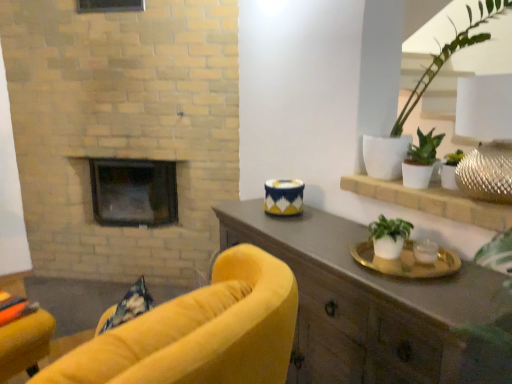
What do you see at coordinates (133, 192) in the screenshot? I see `black glass fireplace at center` at bounding box center [133, 192].

Measure the distance between point [250,296] and camera.

Point [250,296] and camera are 36.46 inches apart.

The height and width of the screenshot is (384, 512). Describe the element at coordinates (284, 197) in the screenshot. I see `blue and white ceramic candle holder at center` at that location.

What do you see at coordinates (450, 169) in the screenshot? I see `green matte houseplant at upper right, the third houseplant from the top` at bounding box center [450, 169].

What is the approximate width of matte brown cabinet at right?

It is 49.09 centimeters.

In order to face white matte plant pot at right, arranged as the second houseplant when viewed from the top, should I rotate leftwards or rightwards?

A 20.950 degree turn to the right will do.

Where is `black glass fireplace at center`? The width and height of the screenshot is (512, 384). black glass fireplace at center is located at coordinates (133, 192).

Can you confirm if velvet yellow armchair at center, the second chair in the left-to-right sequence, is smaller than blue and white ceramic candle holder at center?

Actually, velvet yellow armchair at center, the second chair in the left-to-right sequence, might be larger than blue and white ceramic candle holder at center.

Does velvet yellow armchair at center, the 2th chair viewed from the back, appear on the right side of blue and white ceramic candle holder at center?

No.

From the image's perspective, is black glass fireplace at center above white ceramic plant at upper right?

Yes, from the image's perspective, black glass fireplace at center is on top of white ceramic plant at upper right.

Is black glass fireplace at center positioned with its back to white ceramic plant at upper right?

No.

Find the location of a particular element. The width and height of the screenshot is (512, 384). shelf in front of the black glass fireplace at center is located at coordinates (432, 201).

Looking at this image, would you say white ceramic plant at upper right is inside or outside velvet yellow armchair at center, the 2th chair viewed from the back?

white ceramic plant at upper right is not inside velvet yellow armchair at center, the 2th chair viewed from the back, it's outside.

From the picture: Between white ceramic plant at upper right and velvet yellow armchair at center, which is the 1th chair in front-to-back order, which one is positioned in front?

Positioned in front is velvet yellow armchair at center, which is the 1th chair in front-to-back order.

Identify the location of chair lying in front of the white ceramic plant at upper right. This screenshot has width=512, height=384. (199, 332).

Looking at the image, does white ceramic plant at upper right seem bigger or smaller compared to velvet yellow armchair at center, which is the 1th chair in front-to-back order?

Clearly, white ceramic plant at upper right is smaller in size than velvet yellow armchair at center, which is the 1th chair in front-to-back order.

Is matte brown cabinet at right far away from white matte plant pot at right, the 3th houseplant in the bottom-to-top sequence?

That's not correct — matte brown cabinet at right is a little close to white matte plant pot at right, the 3th houseplant in the bottom-to-top sequence.

Which of these two, matte brown cabinet at right or white matte plant pot at right, arranged as the second houseplant when viewed from the top, is wider?

matte brown cabinet at right is wider.

You are a GUI agent. You are given a task and a screenshot of the screen. Output one action in this format:
    pyautogui.click(x=<x>, y=<y>)
    Task: Click on the cabinetry below the white matte plant pot at right, arranged as the second houseplant when viewed from the top (from a real-world perspective)
    
    Given the screenshot: What is the action you would take?
    pyautogui.click(x=371, y=307)

From a real-world perspective, does matte brown cabinet at right sit lower than white matte plant pot at right, the 3th houseplant in the bottom-to-top sequence?

Correct, in the physical world, matte brown cabinet at right is lower than white matte plant pot at right, the 3th houseplant in the bottom-to-top sequence.

Does velvet yellow armchair at lower left, which appears as the 1th chair when viewed from the left, have a greater width compared to white ceramic plant at upper right?

In fact, velvet yellow armchair at lower left, which appears as the 1th chair when viewed from the left, might be narrower than white ceramic plant at upper right.

Identify the location of chair behind the white ceramic plant at upper right. This screenshot has width=512, height=384. (25, 343).

Considering the positions of points (46, 349) and (503, 209), is point (46, 349) closer to camera compared to point (503, 209)?

No, it is behind (503, 209).

Is white matte pot at upper right, which appears as the 4th houseplant when ordered from the bottom, located within white matte plant at right, arranged as the fourth houseplant when viewed from the top?

No, white matte pot at upper right, which appears as the 4th houseplant when ordered from the bottom, is not a part of white matte plant at right, arranged as the fourth houseplant when viewed from the top.

Between white matte plant at right, the first houseplant positioned from the bottom, and white matte pot at upper right, the 1th houseplant from the top, which one is positioned behind?

white matte plant at right, the first houseplant positioned from the bottom, is further away from the camera.

Which object is positioned more to the right, white matte plant at right, the first houseplant positioned from the bottom, or white matte pot at upper right, the 1th houseplant from the top?

white matte pot at upper right, the 1th houseplant from the top.

From the image's perspective, which is above, white matte plant at right, arranged as the fourth houseplant when viewed from the top, or white matte pot at upper right, the 1th houseplant from the top?

white matte pot at upper right, the 1th houseplant from the top.

Does velvet yellow armchair at lower left, which appears as the 1th chair when viewed from the left, turn towards velvet yellow armchair at center, arranged as the first chair when viewed from the right?

No.

In terms of width, does velvet yellow armchair at lower left, which is counted as the second chair, starting from the right, look wider or thinner when compared to velvet yellow armchair at center, the 2th chair viewed from the back?

Clearly, velvet yellow armchair at lower left, which is counted as the second chair, starting from the right, has less width compared to velvet yellow armchair at center, the 2th chair viewed from the back.

From a real-world perspective, is velvet yellow armchair at lower left, which is counted as the second chair, starting from the right, positioned over velvet yellow armchair at center, arranged as the first chair when viewed from the right, based on gravity?

No.

Who is bigger, velvet yellow armchair at lower left, which is counted as the second chair, starting from the right, or velvet yellow armchair at center, which is the 1th chair in front-to-back order?

With larger size is velvet yellow armchair at center, which is the 1th chair in front-to-back order.

Which chair is the 2nd one when counting from the front of the blue and white ceramic candle holder at center? Please provide its 2D coordinates.

[(199, 332)]

This screenshot has width=512, height=384. In order to click on fireplace on the left of white ceramic plant at upper right in this screenshot , I will do (x=133, y=192).

Based on their spatial positions, is black glass fireplace at center or blue and white ceramic candle holder at center further from white matte pot at upper right, which appears as the 4th houseplant when ordered from the bottom?

black glass fireplace at center is further to white matte pot at upper right, which appears as the 4th houseplant when ordered from the bottom.

When comparing their distances from white matte plant at right, the first houseplant positioned from the bottom, does green matte houseplant at upper right, the 2th houseplant when ordered from bottom to top, or white ceramic plant at upper right seem further?

The object further to white matte plant at right, the first houseplant positioned from the bottom, is green matte houseplant at upper right, the 2th houseplant when ordered from bottom to top.

From the image, which object appears to be nearer to velvet yellow armchair at center, arranged as the first chair when viewed from the right, white matte pot at upper right, which appears as the 4th houseplant when ordered from the bottom, or matte brown cabinet at right?

Among the two, matte brown cabinet at right is located nearer to velvet yellow armchair at center, arranged as the first chair when viewed from the right.

Estimate the real-world distances between objects in this image. Which object is further from velvet yellow armchair at center, arranged as the first chair when viewed from the right, white matte plant at right, arranged as the fourth houseplant when viewed from the top, or green matte houseplant at upper right, the third houseplant from the top?

green matte houseplant at upper right, the third houseplant from the top, is further to velvet yellow armchair at center, arranged as the first chair when viewed from the right.

Considering their positions, is black glass fireplace at center positioned further to matte brown cabinet at right than velvet yellow armchair at center, the 2th chair viewed from the back?

The object further to matte brown cabinet at right is black glass fireplace at center.

Which object lies further to the anchor point white matte plant at right, the first houseplant positioned from the bottom, velvet yellow armchair at center, arranged as the first chair when viewed from the right, or velvet yellow armchair at lower left, the 1th chair positioned from the back?

velvet yellow armchair at lower left, the 1th chair positioned from the back, is further to white matte plant at right, the first houseplant positioned from the bottom.

When comparing their distances from matte brown cabinet at right, does white matte pot at upper right, the 1th houseplant from the top, or blue and white ceramic candle holder at center seem closer?

blue and white ceramic candle holder at center.

Based on their spatial positions, is matte brown cabinet at right or black glass fireplace at center closer to velvet yellow armchair at center, arranged as the first chair when viewed from the right?

matte brown cabinet at right.

The height and width of the screenshot is (384, 512). Find the location of `candle holder between white matte pot at upper right, which appears as the 4th houseplant when ordered from the bottom, and matte brown cabinet at right in the up-down direction`. candle holder between white matte pot at upper right, which appears as the 4th houseplant when ordered from the bottom, and matte brown cabinet at right in the up-down direction is located at coordinates (284, 197).

Locate an element on the screen. chair between velvet yellow armchair at lower left, which appears as the 1th chair when viewed from the left, and white matte pot at upper right, the 1th houseplant from the top is located at coordinates (199, 332).

The width and height of the screenshot is (512, 384). Find the location of `shelf that lies between white matte pot at upper right, which appears as the 4th houseplant when ordered from the bottom, and white matte plant at right, arranged as the fourth houseplant when viewed from the top, from top to bottom`. shelf that lies between white matte pot at upper right, which appears as the 4th houseplant when ordered from the bottom, and white matte plant at right, arranged as the fourth houseplant when viewed from the top, from top to bottom is located at coordinates (432, 201).

Find the location of a particular element. cabinetry between velvet yellow armchair at center, the second chair in the left-to-right sequence, and blue and white ceramic candle holder at center in the front-back direction is located at coordinates (371, 307).